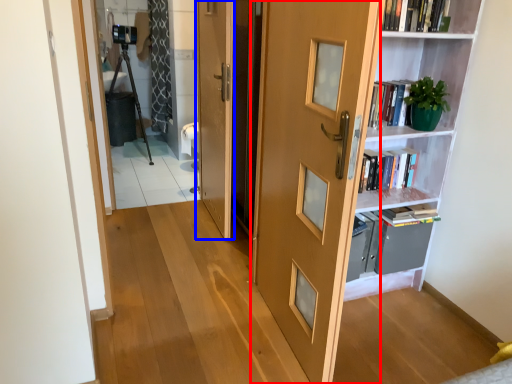
Question: Which of the following is the closest to the observer, door (highlighted by a red box) or door (highlighted by a blue box)?

Choices:
 (A) door
 (B) door

Answer: (A)